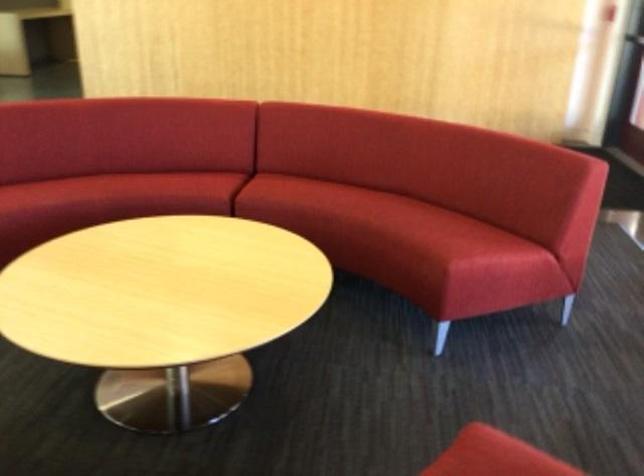
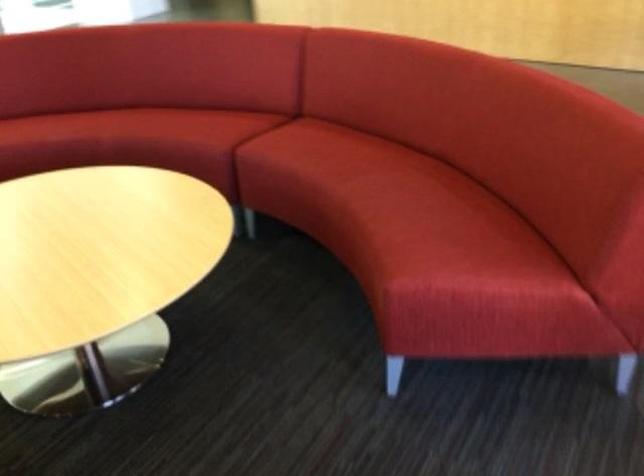
In a continuous first-person perspective shot, in which direction is the camera moving?

The cameraman moved toward right, forward.